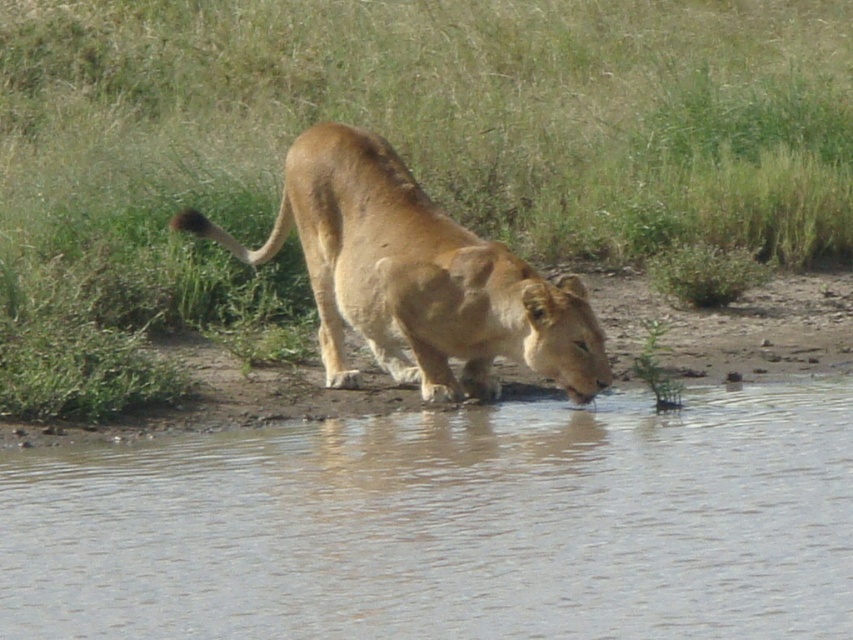
You are a wildlife photographer trying to capture a photo of the golden fur lion at center. To get the best shot, you need to position yourself so that the clear water at lower center is reflected in the lionesss fur. Is this possible based on the scene described?

The clear water at lower center is below the golden fur lion at center, so it is possible to position yourself to capture the reflection of the water in the lionesss fur as long as the water surface is calm enough to reflect the fur.

Based on the photo, you are a photographer trying to capture the golden fur lion at center drinking water. To get a clear shot of the lion, should you adjust your position to avoid the clear water at lower center blocking the view?

The clear water at lower center is in front of the golden fur lion at center, so adjusting your position to avoid the water will ensure the lion is not blocked and provides a clearer view.